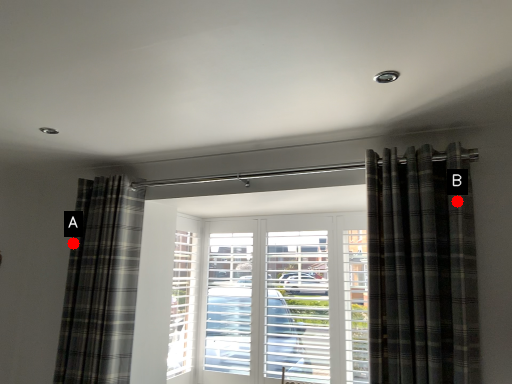
Question: Two points are circled on the image, labeled by A and B beside each circle. Which of the following is the farthest from the observer?

Choices:
 (A) A is further
 (B) B is further

Answer: (A)